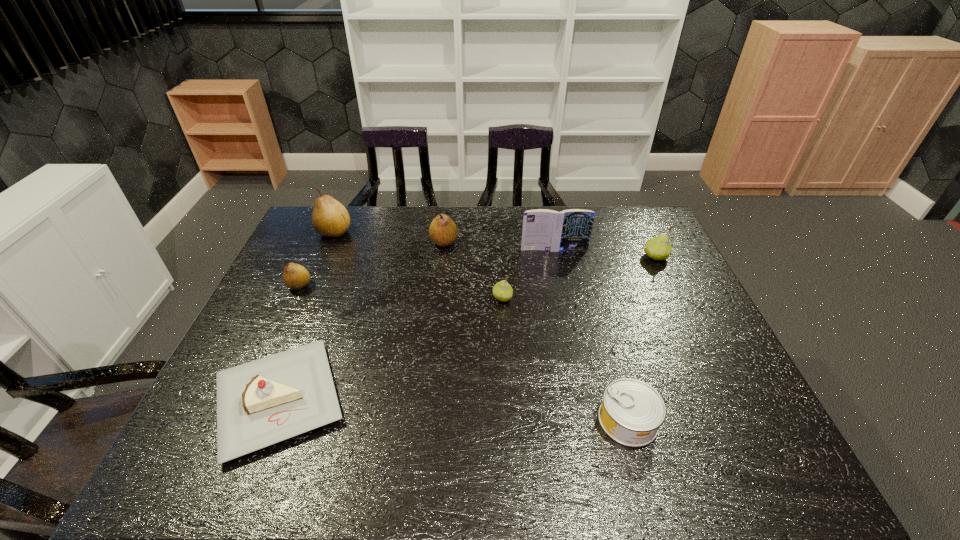
Locate an element on the screen. object that is the closest to the book is located at coordinates (658, 248).

Point out which object is positioned as the third nearest to the book. Please provide its 2D coordinates. Your answer should be formatted as a tuple, i.e. [(x, y)], where the tuple contains the x and y coordinates of a point satisfying the conditions above.

[(443, 231)]

Select which pear is the second closest to the silver can. Please provide its 2D coordinates. Your answer should be formatted as a tuple, i.e. [(x, y)], where the tuple contains the x and y coordinates of a point satisfying the conditions above.

[(658, 248)]

Identify the location of pear that is the closest one to the fifth object from left to right. (443, 231).

Select which brown pear is the third closest to the rightmost object. Please provide its 2D coordinates. Your answer should be formatted as a tuple, i.e. [(x, y)], where the tuple contains the x and y coordinates of a point satisfying the conditions above.

[(296, 277)]

You are a GUI agent. You are given a task and a screenshot of the screen. Output one action in this format:
    pyautogui.click(x=<x>, y=<y>)
    Task: Click on the brown pear that is the nearest to the silver can
    The image size is (960, 540).
    Given the screenshot: What is the action you would take?
    pyautogui.click(x=443, y=231)

Find the location of `free space in the image that satisfies the following two spatial constraints: 1. on the front side of the second smallest brown pear; 2. on the left side of the silver can`. free space in the image that satisfies the following two spatial constraints: 1. on the front side of the second smallest brown pear; 2. on the left side of the silver can is located at coordinates (426, 420).

Find the location of a particular element. vacant space that satisfies the following two spatial constraints: 1. on the back side of the smaller green pear; 2. on the right side of the cake is located at coordinates (319, 298).